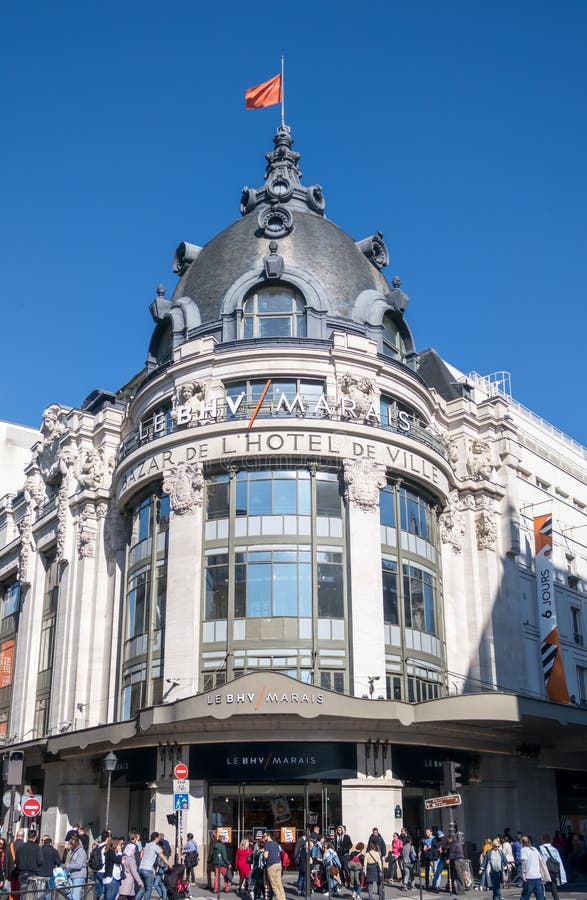
Identify the location of hotel. This screenshot has height=900, width=587. (268, 439).